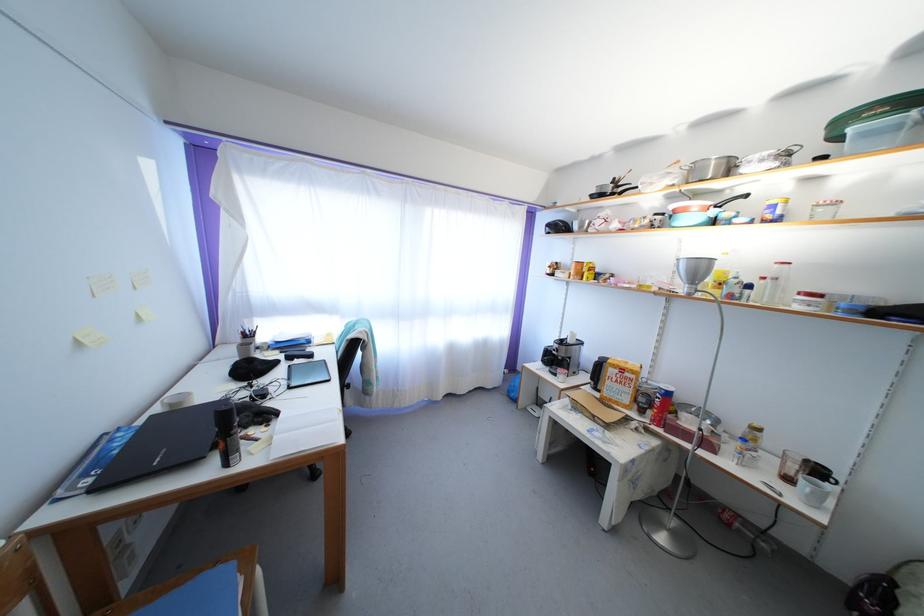
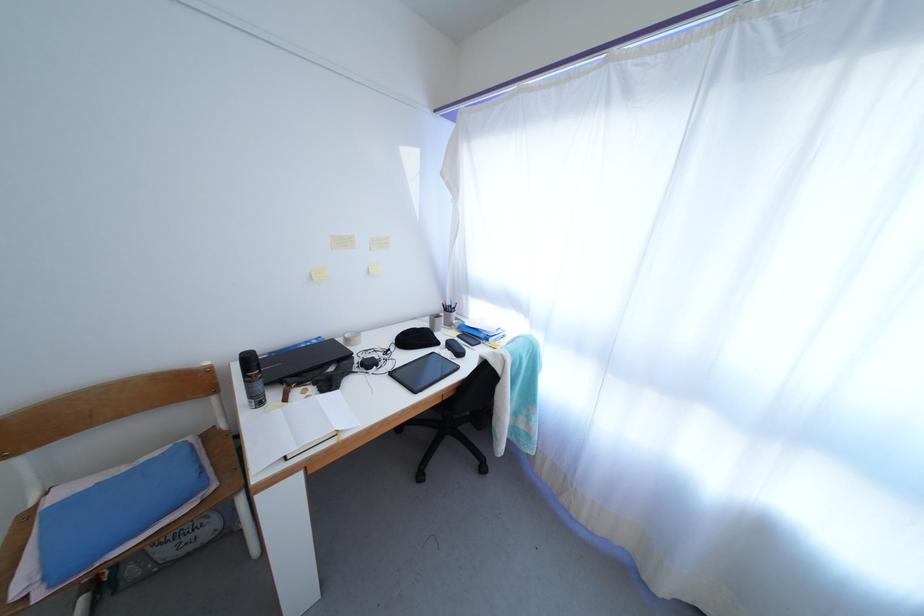
The point at (296, 394) is marked in the first image. Where is the corresponding point in the second image?

(397, 379)